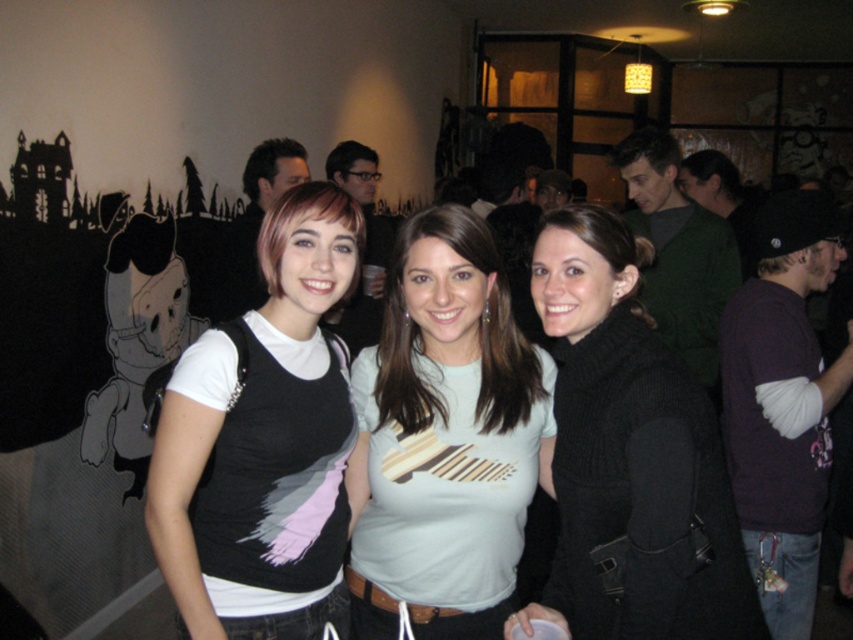
Question: Does matte black t-shirt at center appear over light gray cotton t-shirt at center?

Choices:
 (A) no
 (B) yes

Answer: (B)

Question: Is matte black t-shirt at center thinner than black wool sweater at center?

Choices:
 (A) no
 (B) yes

Answer: (B)

Question: Which object is farther from the camera taking this photo?

Choices:
 (A) matte black t-shirt at center
 (B) black wool sweater at center

Answer: (A)

Question: Which point is farther to the camera?

Choices:
 (A) matte black shirt at center
 (B) black wool sweater at center

Answer: (A)

Question: Which point is closer to the camera taking this photo?

Choices:
 (A) (689, 445)
 (B) (451, 257)
 (C) (810, 344)
 (D) (303, 404)

Answer: (A)

Question: Considering the relative positions of matte black t-shirt at center and matte black shirt at center in the image provided, where is matte black t-shirt at center located with respect to matte black shirt at center?

Choices:
 (A) right
 (B) left

Answer: (B)